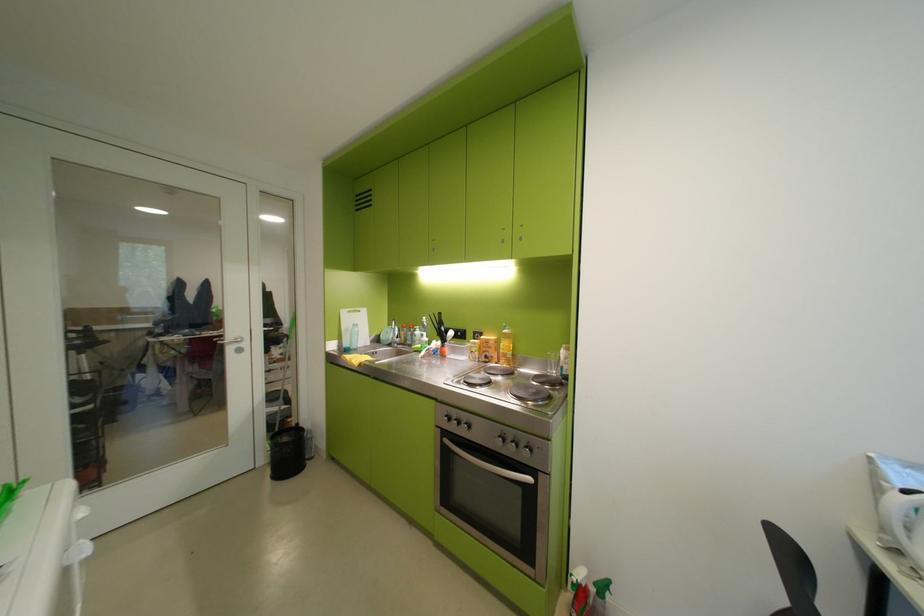
Locate an element on the screen. light blue bottle is located at coordinates (353, 337).